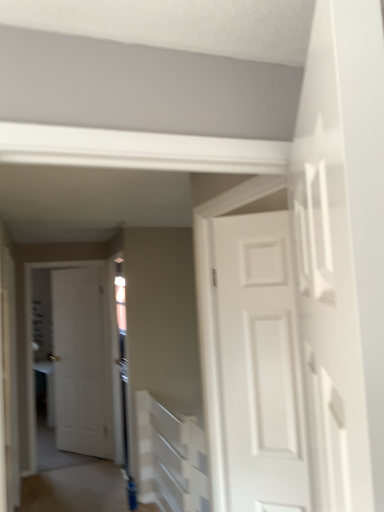
Question: Considering the positions of white textured stairwell at center and white matte door at center, the first door positioned from the left, in the image, is white textured stairwell at center wider or thinner than white matte door at center, the first door positioned from the left,?

Choices:
 (A) wide
 (B) thin

Answer: (A)

Question: From the image's perspective, relative to white matte door at center, which appears as the second door when viewed from the front, is white textured stairwell at center above or below?

Choices:
 (A) below
 (B) above

Answer: (A)

Question: Based on their relative distances, which object is nearer to the white matte door at center, the first door positioned from the left?

Choices:
 (A) blue glossy door at lower center
 (B) white matte door at center, which is the 2th door from back to front
 (C) white textured stairwell at center

Answer: (A)

Question: Estimate the real-world distances between objects in this image. Which object is farther from the white matte door at center, which is the 1th door from right to left?

Choices:
 (A) white textured stairwell at center
 (B) blue glossy door at lower center
 (C) white matte door at center, which appears as the second door when viewed from the front

Answer: (C)